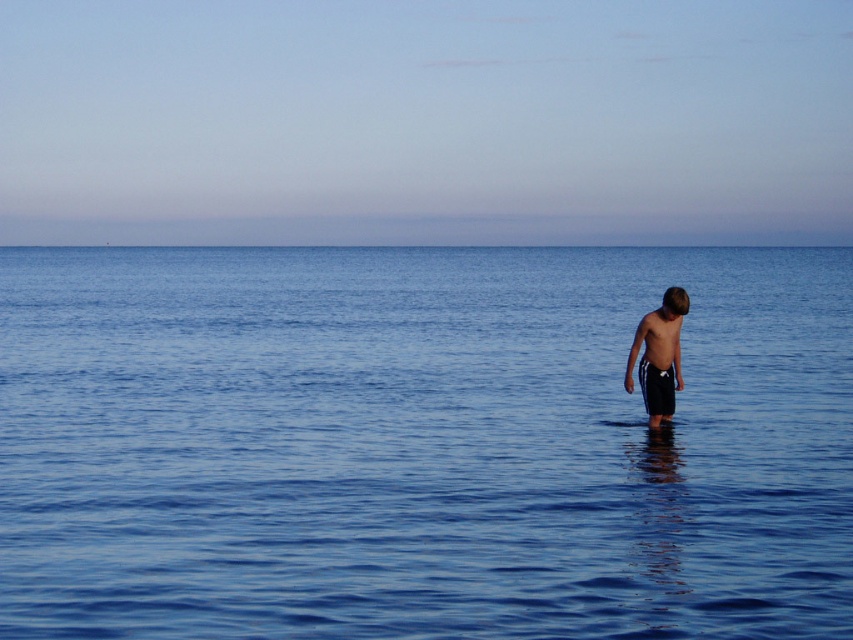
You are standing on the beach and see two points in the sky. The first point is at coordinates point (422, 236) and the second point is at point (679, 294). Which point is closer to the horizon?

Point (422, 236) is behind point (679, 294), so the point closer to the horizon is point (679, 294).

You are standing on a cliff overlooking the ocean and see the blue smooth water at center and the blue smooth water at upper center. Which one is wider?

The blue smooth water at upper center is wider than the blue smooth water at center.

You are a photographer planning to capture the reflection of the sky in the blue smooth water at center and the blue smooth water at upper center. Which area of water would allow for a clearer reflection of the sky?

The blue smooth water at center would provide a clearer reflection of the sky because it is larger in size than the blue smooth water at upper center, and larger bodies of still water typically offer better reflection quality.